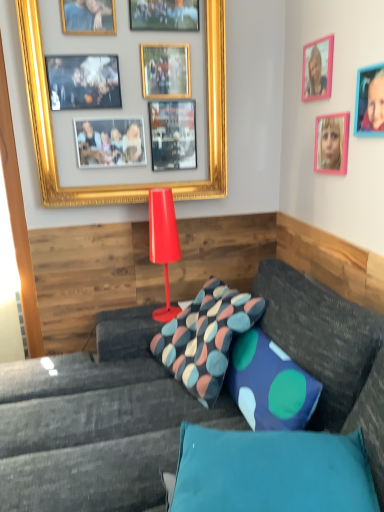
Question: Is pink plastic picture frame at upper right, which is counted as the 1th picture frame, starting from the right, far away from pink plastic picture frame at upper right, which ranks as the 2th picture frame in right-to-left order?

Choices:
 (A) no
 (B) yes

Answer: (A)

Question: Considering the relative sizes of pink plastic picture frame at upper right, which is counted as the 1th picture frame, starting from the right, and pink plastic picture frame at upper right, which ranks as the 2th picture frame in right-to-left order, in the image provided, is pink plastic picture frame at upper right, which is counted as the 1th picture frame, starting from the right, wider than pink plastic picture frame at upper right, which ranks as the 2th picture frame in right-to-left order,?

Choices:
 (A) yes
 (B) no

Answer: (B)

Question: Is pink plastic picture frame at upper right, which is counted as the 1th picture frame, starting from the right, positioned in front of pink plastic picture frame at upper right, acting as the third picture frame starting from the left?

Choices:
 (A) yes
 (B) no

Answer: (A)

Question: Is pink plastic picture frame at upper right, positioned as the 4th picture frame in left-to-right order, aimed at pink plastic picture frame at upper right, which ranks as the 2th picture frame in right-to-left order?

Choices:
 (A) yes
 (B) no

Answer: (B)

Question: From the image's perspective, is pink plastic picture frame at upper right, positioned as the 4th picture frame in left-to-right order, located beneath pink plastic picture frame at upper right, acting as the third picture frame starting from the left?

Choices:
 (A) no
 (B) yes

Answer: (A)

Question: Considering the positions of pink plastic picture frame at upper right, positioned as the 4th picture frame in left-to-right order, and gold/gilded picture frame at upper left, which is the first picture frame in left-to-right order, in the image, is pink plastic picture frame at upper right, positioned as the 4th picture frame in left-to-right order, bigger or smaller than gold/gilded picture frame at upper left, which is the first picture frame in left-to-right order,?

Choices:
 (A) small
 (B) big

Answer: (A)

Question: Is pink plastic picture frame at upper right, which is counted as the 1th picture frame, starting from the right, wider or thinner than gold/gilded picture frame at upper left, which appears as the fourth picture frame when viewed from the right?

Choices:
 (A) wide
 (B) thin

Answer: (B)

Question: Which is correct: pink plastic picture frame at upper right, which is counted as the 1th picture frame, starting from the right, is inside gold/gilded picture frame at upper left, which appears as the fourth picture frame when viewed from the right, or outside of it?

Choices:
 (A) outside
 (B) inside

Answer: (A)

Question: Is pink plastic picture frame at upper right, positioned as the 4th picture frame in left-to-right order, in front of or behind gold/gilded picture frame at upper left, which is the first picture frame in left-to-right order, in the image?

Choices:
 (A) behind
 (B) front

Answer: (B)

Question: Is point (193, 321) closer or farther from the camera than point (213, 46)?

Choices:
 (A) closer
 (B) farther

Answer: (A)

Question: From their relative heights in the image, would you say multicolored fabric pillow at center, the first pillow viewed from the back, is taller or shorter than gold/gilded picture frame at upper left, which appears as the fourth picture frame when viewed from the right?

Choices:
 (A) tall
 (B) short

Answer: (B)

Question: Considering the relative positions of multicolored fabric pillow at center, the first pillow viewed from the back, and gold/gilded picture frame at upper left, which is the first picture frame in left-to-right order, in the image provided, is multicolored fabric pillow at center, the first pillow viewed from the back, to the left or to the right of gold/gilded picture frame at upper left, which is the first picture frame in left-to-right order,?

Choices:
 (A) right
 (B) left

Answer: (A)

Question: Is multicolored fabric pillow at center, the 2th pillow when ordered from front to back, spatially inside gold/gilded picture frame at upper left, which appears as the fourth picture frame when viewed from the right, or outside of it?

Choices:
 (A) inside
 (B) outside

Answer: (B)

Question: In terms of width, does multicolored fabric pillow at center, the 2th pillow when ordered from front to back, look wider or thinner when compared to pink plastic picture frame at upper right, which is counted as the 1th picture frame, starting from the right?

Choices:
 (A) wide
 (B) thin

Answer: (A)

Question: In the image, is multicolored fabric pillow at center, the first pillow viewed from the back, positioned in front of or behind pink plastic picture frame at upper right, positioned as the 4th picture frame in left-to-right order?

Choices:
 (A) front
 (B) behind

Answer: (B)